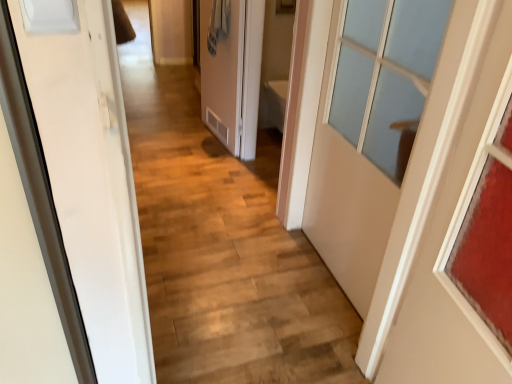
Locate an element on the screen. This screenshot has height=384, width=512. free point in front of matte white door at center, which appears as the 1th door when viewed from the left is located at coordinates (209, 162).